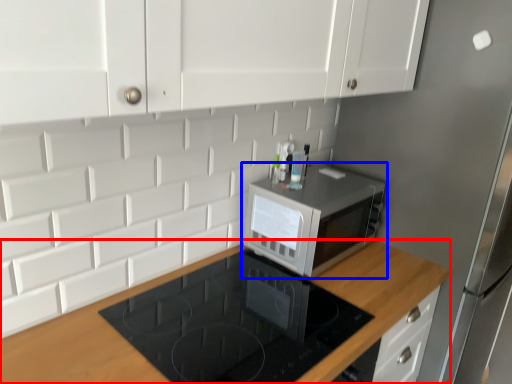
Question: Which object appears farthest to the camera in this image, countertop (highlighted by a red box) or microwave oven (highlighted by a blue box)?

Choices:
 (A) countertop
 (B) microwave oven

Answer: (B)